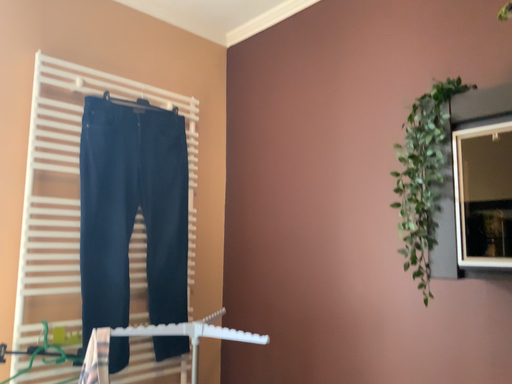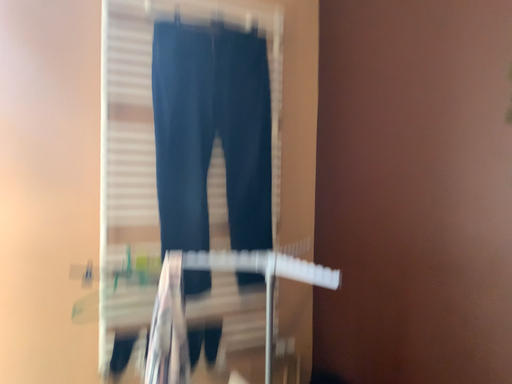
Question: How did the camera likely rotate when shooting the video?

Choices:
 (A) rotated left
 (B) rotated right

Answer: (A)